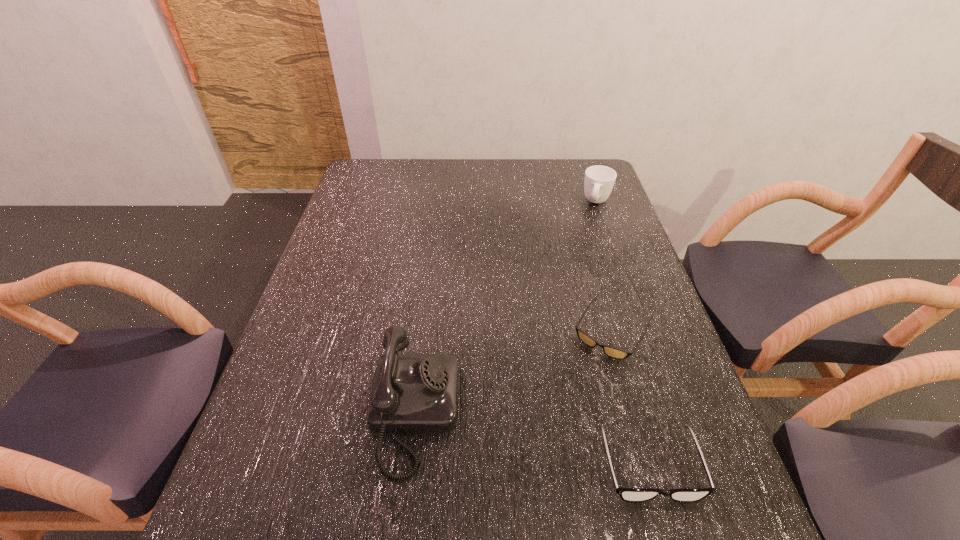
This screenshot has height=540, width=960. I want to click on vacant space on the desktop that is between the tallest object and the spectacles and is positioned on the front-facing side of the sunglasses, so click(x=545, y=442).

In order to click on vacant spot on the desktop that is between the leftmost object and the second shortest object and is positioned with the handle on the side of the third shortest object in this screenshot , I will do `click(531, 438)`.